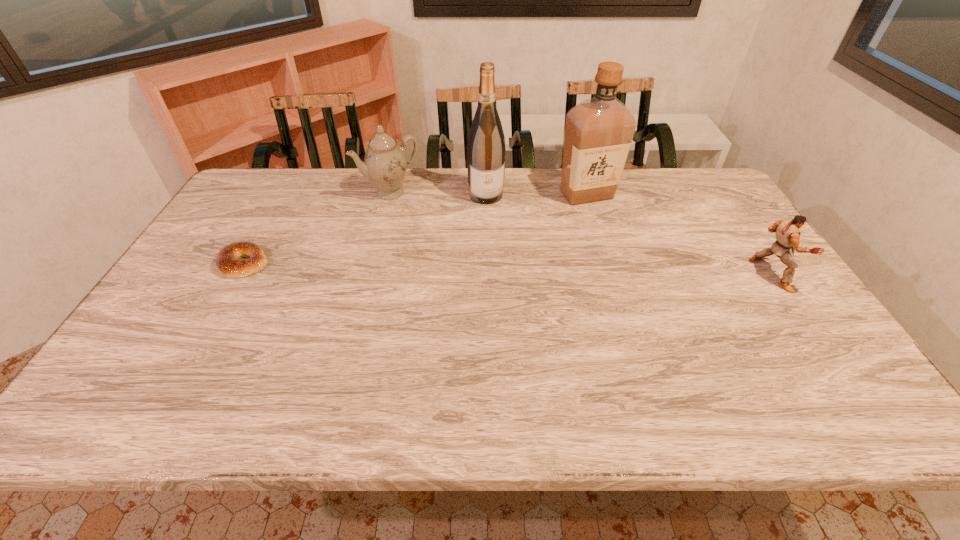
Where is `free space on the desktop that is between the bagel and the fourth tallest object and is positioned on the spout of the chinaware`? This screenshot has width=960, height=540. free space on the desktop that is between the bagel and the fourth tallest object and is positioned on the spout of the chinaware is located at coordinates (446, 267).

Where is `vacant space on the desktop that is between the leftmost object and the fourth tallest object and is positioned on the front-facing side of the fourth object from left to right`? vacant space on the desktop that is between the leftmost object and the fourth tallest object and is positioned on the front-facing side of the fourth object from left to right is located at coordinates (568, 270).

This screenshot has height=540, width=960. I want to click on vacant space on the desktop that is between the leftmost object and the puncher and is positioned on the label of the third object from right to left, so click(x=505, y=269).